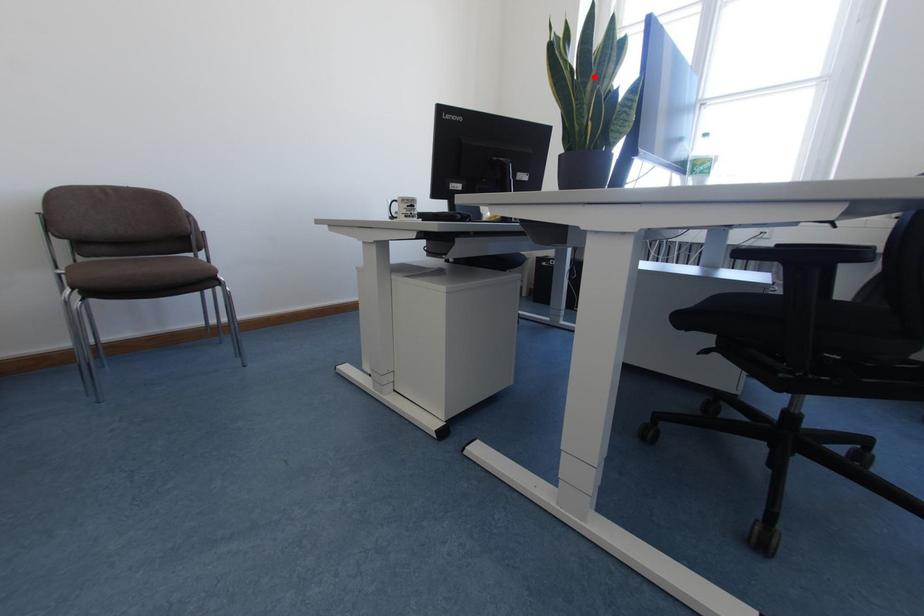
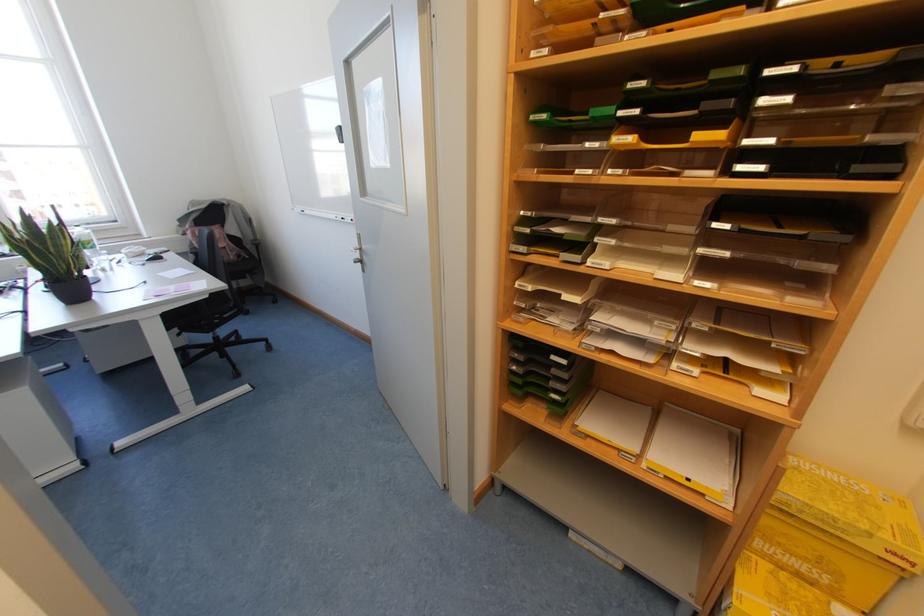
The point at the highlighted location is marked in the first image. Where is the corresponding point in the second image?

(53, 245)